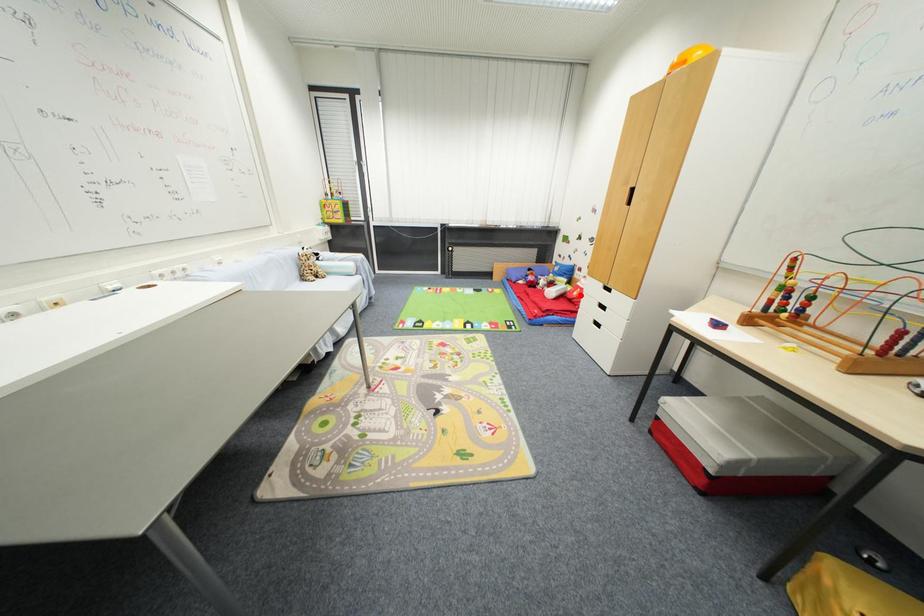
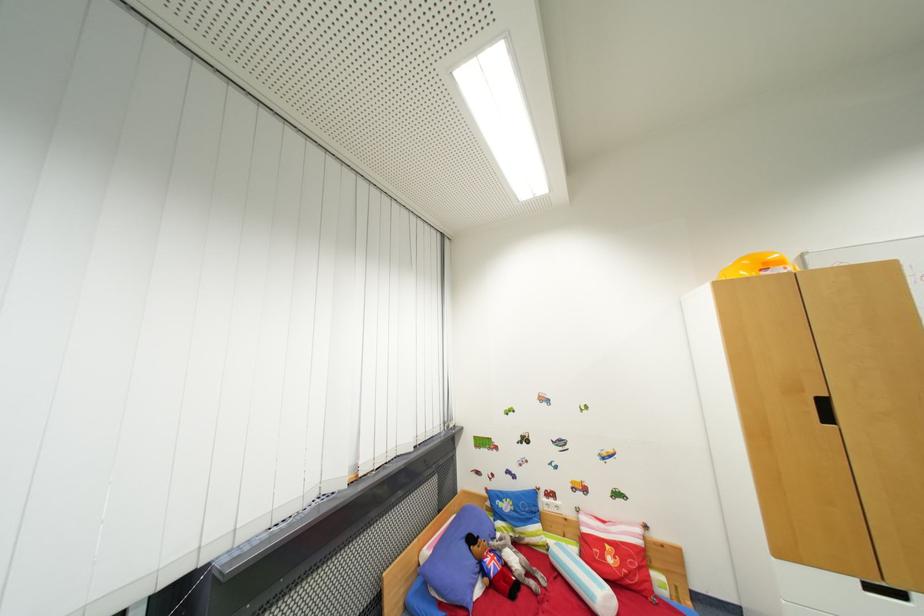
Question: I am providing you with two images of the same scene from different viewpoints. In image1, a red point is highlighted. Considering the same 3D point in image2, which of the following is correct?

Choices:
 (A) It is closer
 (B) It is farther

Answer: (B)